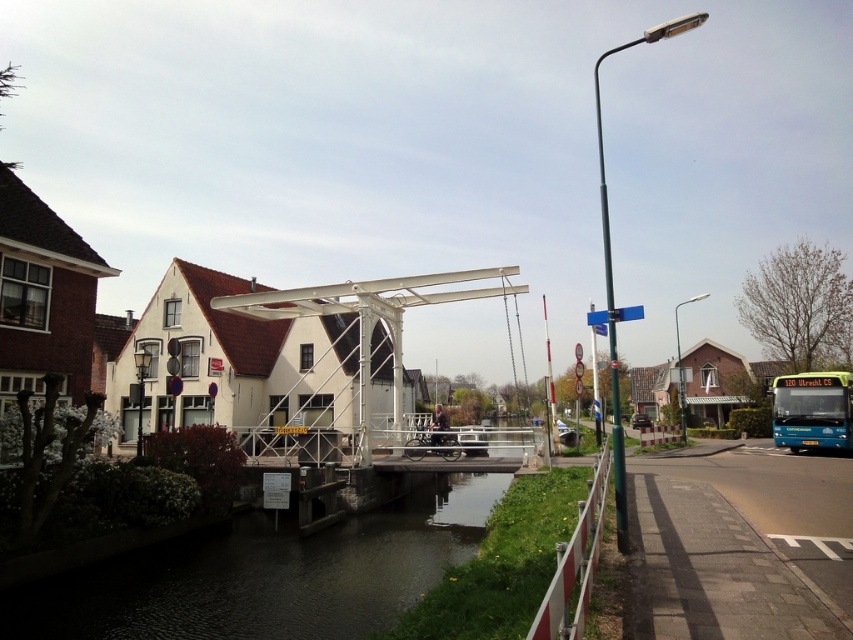
Is point (834, 387) positioned after point (602, 250)?

No, it is not.

Is teal matte bus at lower right positioned behind metallic pole at right?

Yes, it is behind metallic pole at right.

Does point (805, 380) lie behind point (601, 160)?

That is False.

I want to click on teal matte bus at lower right, so click(811, 410).

Can you confirm if dark water at center is bigger than metallic pole at upper right?

No.

What do you see at coordinates (267, 577) in the screenshot? The width and height of the screenshot is (853, 640). I see `dark water at center` at bounding box center [267, 577].

Who is more distant from viewer, (33, 593) or (677, 320)?

Positioned behind is point (677, 320).

The height and width of the screenshot is (640, 853). Identify the location of dark water at center. (267, 577).

Locate an element on the screen. Image resolution: width=853 pixels, height=640 pixels. metallic pole at right is located at coordinates (611, 268).

Measure the distance between point [596,134] and camera.

The distance of point [596,134] from camera is 135.47 meters.

At what (x,y) coordinates should I click in order to perform the action: click on metallic pole at right. Please return your answer as a coordinate pair (x, y). The height and width of the screenshot is (640, 853). Looking at the image, I should click on [611, 268].